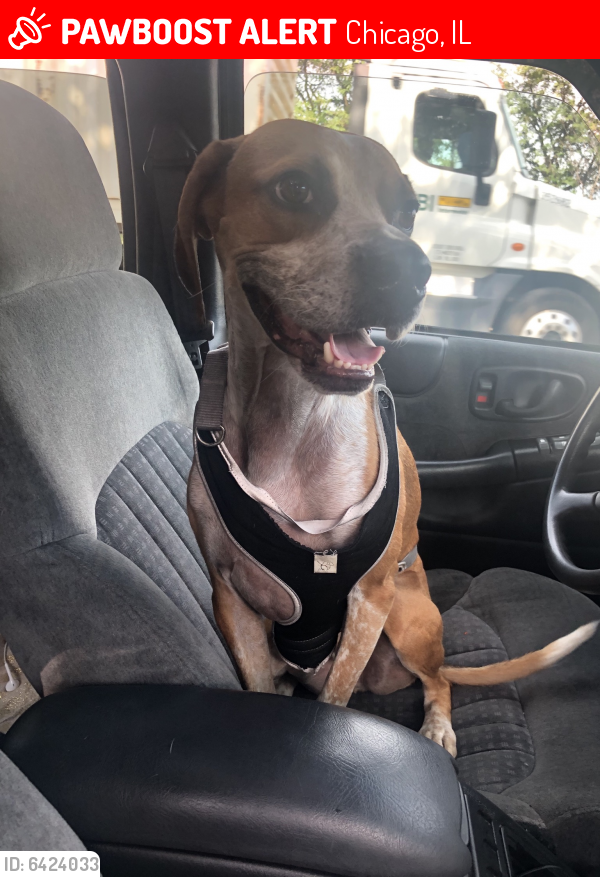
Identify the location of window. This screenshot has height=877, width=600. (484, 173).